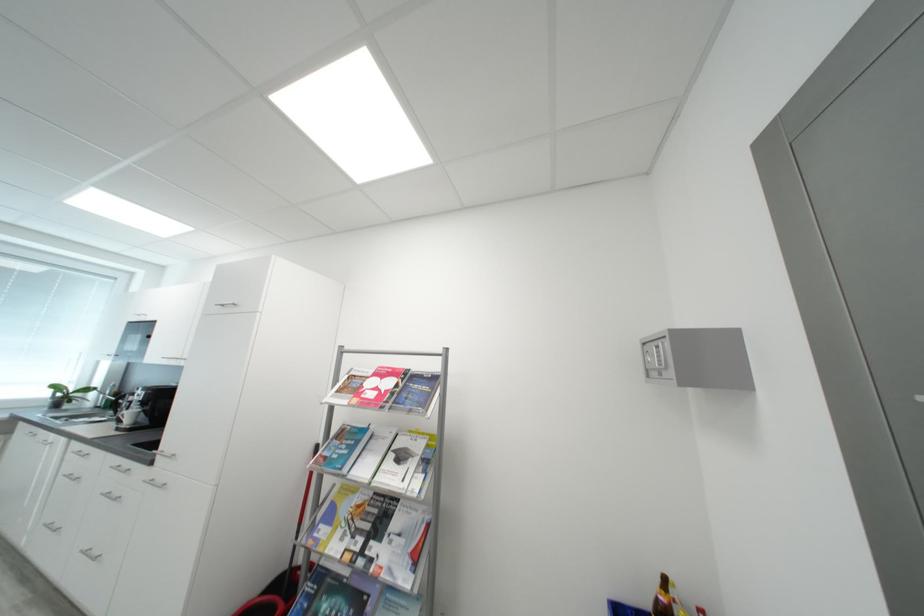
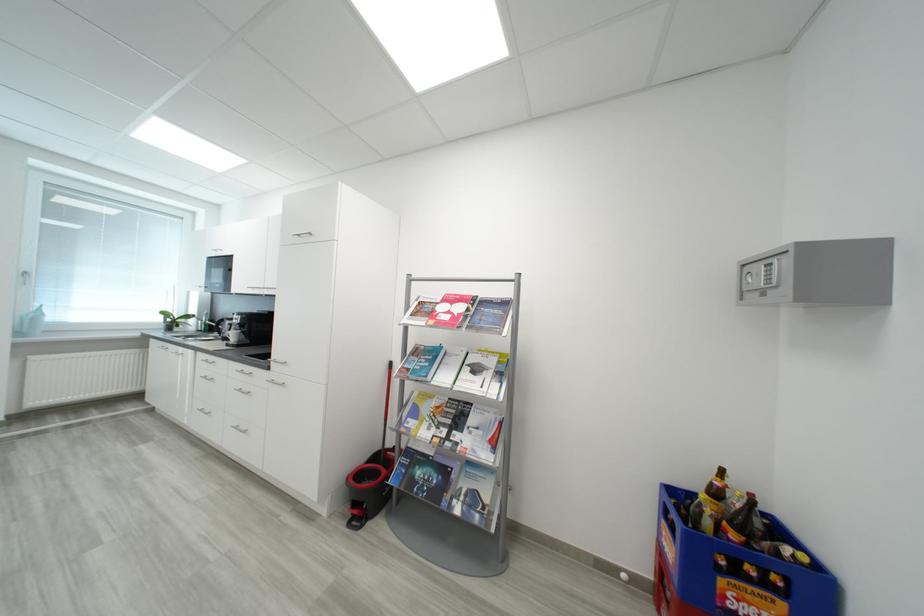
Question: Based on the continuous images, in which direction is the camera rotating? Reply with the corresponding letter.

Choices:
 (A) Left
 (B) Right
 (C) Up
 (D) Down

Answer: (D)